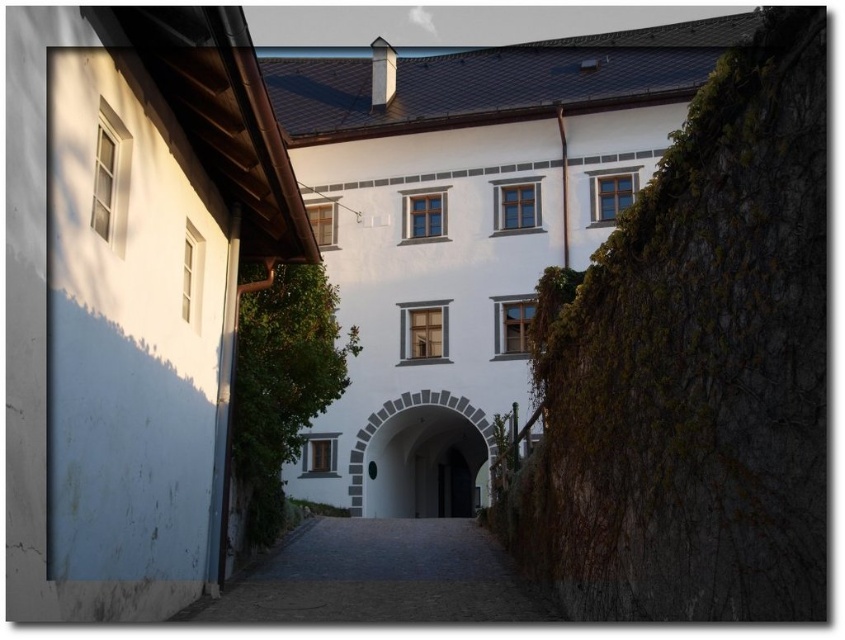
Between point (292, 566) and point (368, 428), which one is positioned in front?

Positioned in front is point (292, 566).

Which is behind, point (315, 557) or point (459, 397)?

Positioned behind is point (459, 397).

Between point (401, 520) and point (489, 442), which one is positioned in front?

Point (401, 520) is in front.

At what (x,y) coordinates should I click in order to perform the action: click on dark stone path at center. Please return your answer as a coordinate pair (x, y). The height and width of the screenshot is (640, 845). Looking at the image, I should click on (379, 577).

Between white stone archway at center and dark wood door at center, which one has more height?

white stone archway at center is taller.

Between white stone archway at center and dark wood door at center, which one appears on the left side from the viewer's perspective?

Positioned to the left is white stone archway at center.

Does point (352, 480) come behind point (451, 477)?

No, (352, 480) is in front of (451, 477).

The width and height of the screenshot is (845, 640). I want to click on white stone archway at center, so click(398, 412).

Can you confirm if dark stone path at center is thinner than dark wood door at center?

No.

Who is lower down, dark stone path at center or dark wood door at center?

dark wood door at center is lower down.

Between point (252, 618) and point (455, 506), which one is positioned in front?

Point (252, 618) is in front.

Locate an element on the screen. The height and width of the screenshot is (640, 845). dark stone path at center is located at coordinates (379, 577).